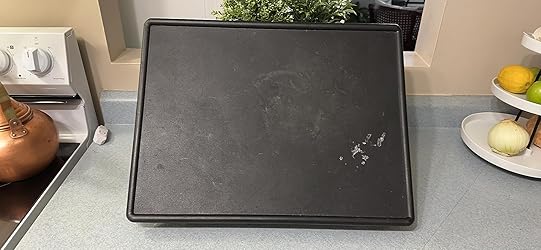
Where is `plant`? This screenshot has width=541, height=250. plant is located at coordinates (294, 14).